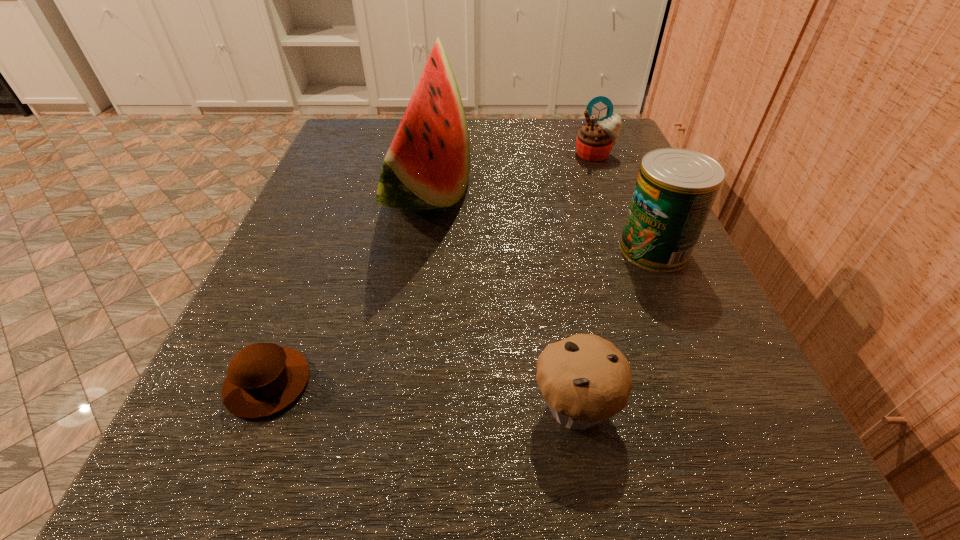
Locate an element on the screen. object positioned at the far left corner is located at coordinates (427, 166).

Image resolution: width=960 pixels, height=540 pixels. I want to click on object present at the far right corner, so click(594, 142).

Locate an element on the screen. This screenshot has height=540, width=960. object at the near right corner is located at coordinates (585, 379).

This screenshot has width=960, height=540. I want to click on free space at the near edge of the desktop, so click(x=511, y=502).

In the image, there is a desktop. What are the coordinates of `vacant space at the left edge` in the screenshot? It's located at coord(367,224).

Locate an element on the screen. free location at the right edge is located at coordinates (599, 245).

In the image, there is a desktop. Identify the location of vacant space at the far left corner. (385, 122).

At what (x,y) coordinates should I click in order to perform the action: click on vacant space at the far right corner. Please return your answer as a coordinate pair (x, y). The image size is (960, 540). Looking at the image, I should click on (579, 126).

The width and height of the screenshot is (960, 540). Find the location of `blank space at the near right corner of the desktop`. blank space at the near right corner of the desktop is located at coordinates (670, 531).

Locate an element on the screen. Image resolution: width=960 pixels, height=540 pixels. free space between the second tallest object and the watermelon is located at coordinates (541, 220).